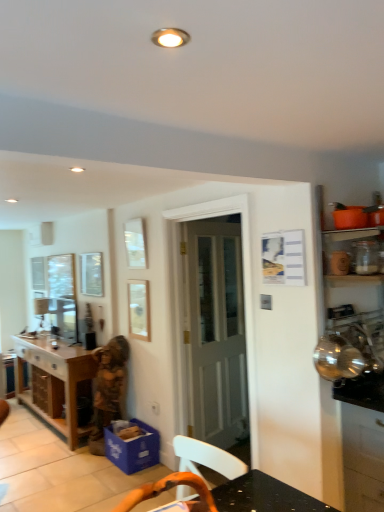
Question: Should I look upward or downward to see wooden statue at center?

Choices:
 (A) down
 (B) up

Answer: (A)

Question: Is satin black cabinet at right, acting as the first cabinetry starting from the right, smaller than wooden table at lower left?

Choices:
 (A) no
 (B) yes

Answer: (B)

Question: Can you confirm if satin black cabinet at right, which is the second cabinetry in left-to-right order, is thinner than wooden table at lower left?

Choices:
 (A) yes
 (B) no

Answer: (B)

Question: Are satin black cabinet at right, marked as the 2th cabinetry in a back-to-front arrangement, and wooden table at lower left located far from each other?

Choices:
 (A) yes
 (B) no

Answer: (A)

Question: Is satin black cabinet at right, which is the second cabinetry in left-to-right order, at the right side of wooden table at lower left?

Choices:
 (A) yes
 (B) no

Answer: (A)

Question: Is satin black cabinet at right, acting as the first cabinetry starting from the right, to the left of wooden table at lower left from the viewer's perspective?

Choices:
 (A) yes
 (B) no

Answer: (B)

Question: Is satin black cabinet at right, acting as the first cabinetry starting from the right, shorter than wooden table at lower left?

Choices:
 (A) no
 (B) yes

Answer: (A)

Question: Are translucent glass jar at upper right and white wooden door at center far apart?

Choices:
 (A) no
 (B) yes

Answer: (B)

Question: Considering the relative sizes of translucent glass jar at upper right and white wooden door at center in the image provided, is translucent glass jar at upper right thinner than white wooden door at center?

Choices:
 (A) no
 (B) yes

Answer: (A)

Question: Considering the relative sizes of translucent glass jar at upper right and white wooden door at center in the image provided, is translucent glass jar at upper right shorter than white wooden door at center?

Choices:
 (A) no
 (B) yes

Answer: (B)

Question: Is translucent glass jar at upper right to the left of white wooden door at center from the viewer's perspective?

Choices:
 (A) no
 (B) yes

Answer: (A)

Question: Can you see translucent glass jar at upper right touching white wooden door at center?

Choices:
 (A) no
 (B) yes

Answer: (A)

Question: From a real-world perspective, is translucent glass jar at upper right located beneath white wooden door at center?

Choices:
 (A) no
 (B) yes

Answer: (A)

Question: From the image's perspective, would you say translucent glass jar at upper right is positioned over blue cardboard box at lower center, the second cabinetry when ordered from front to back?

Choices:
 (A) yes
 (B) no

Answer: (A)